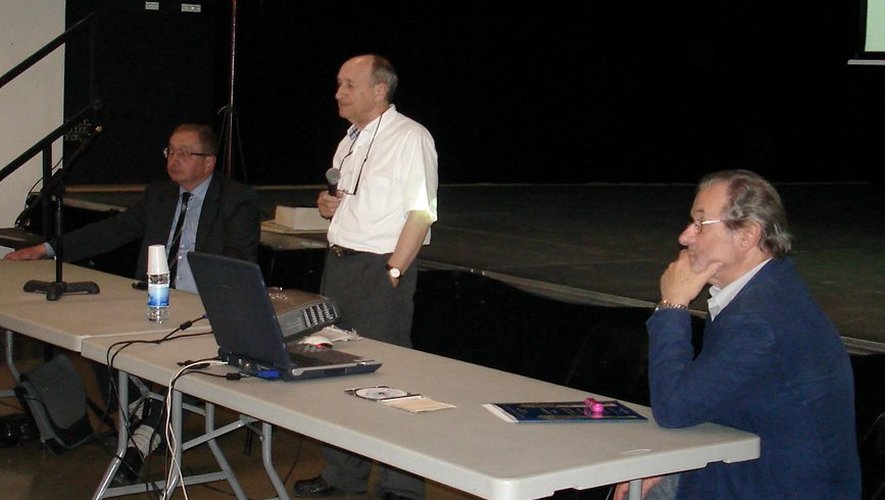
Identify the location of mic. (335, 175).